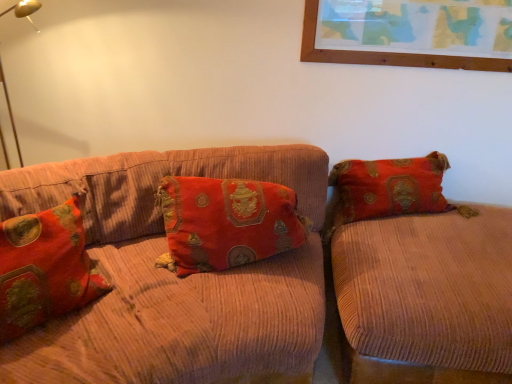
Locate an element on the screen. The image size is (512, 384). velvet-like red pillow at left, the 2th pillow viewed from the right is located at coordinates (45, 269).

Locate an element on the screen. velvet orange couch at right, the second studio couch when ordered from left to right is located at coordinates (420, 276).

The image size is (512, 384). What do you see at coordinates (175, 278) in the screenshot?
I see `corduroy couch at center, the 2th studio couch positioned from the right` at bounding box center [175, 278].

What are the coordinates of `velvet-like red pillow at left, the 2th pillow viewed from the right` in the screenshot? It's located at (45, 269).

Which is more to the right, velvet-like red pillow at left, the 2th pillow viewed from the right, or velvet-like red pillow at center, which appears as the 1th pillow when viewed from the right?

velvet-like red pillow at center, which appears as the 1th pillow when viewed from the right, is more to the right.

Which point is more forward, [53,271] or [238,244]?

The point [53,271] is in front.

Is velvet-like red pillow at left, the 2th pillow viewed from the right, closer to camera compared to velvet-like red pillow at center, which appears as the 1th pillow when viewed from the right?

Yes, it is in front of velvet-like red pillow at center, which appears as the 1th pillow when viewed from the right.

Does velvet-like red pillow at left, which is the 1th pillow in left-to-right order, have a larger size compared to velvet-like red pillow at center, which appears as the 1th pillow when viewed from the right?

Indeed, velvet-like red pillow at left, which is the 1th pillow in left-to-right order, has a larger size compared to velvet-like red pillow at center, which appears as the 1th pillow when viewed from the right.

Considering the positions of objects velvet-like red pillow at left, the 2th pillow viewed from the right, and corduroy couch at center, which is counted as the first studio couch, starting from the left, in the image provided, who is behind, velvet-like red pillow at left, the 2th pillow viewed from the right, or corduroy couch at center, which is counted as the first studio couch, starting from the left,?

corduroy couch at center, which is counted as the first studio couch, starting from the left, is further away from the camera.

In the scene shown: Does velvet-like red pillow at left, the 2th pillow viewed from the right, have a larger size compared to corduroy couch at center, which is counted as the first studio couch, starting from the left?

No.

Is velvet-like red pillow at left, which is the 1th pillow in left-to-right order, not within corduroy couch at center, which is counted as the first studio couch, starting from the left?

No, velvet-like red pillow at left, which is the 1th pillow in left-to-right order, is inside or overlapping with corduroy couch at center, which is counted as the first studio couch, starting from the left.

Is velvet-like red pillow at center, the second pillow positioned from the left, further to the viewer compared to corduroy couch at center, which is counted as the first studio couch, starting from the left?

Yes.

Does velvet-like red pillow at center, which appears as the 1th pillow when viewed from the right, have a greater height compared to corduroy couch at center, which is counted as the first studio couch, starting from the left?

No, velvet-like red pillow at center, which appears as the 1th pillow when viewed from the right, is not taller than corduroy couch at center, which is counted as the first studio couch, starting from the left.

Does velvet-like red pillow at center, the second pillow positioned from the left, have a lesser width compared to corduroy couch at center, which is counted as the first studio couch, starting from the left?

Correct, the width of velvet-like red pillow at center, the second pillow positioned from the left, is less than that of corduroy couch at center, which is counted as the first studio couch, starting from the left.

Consider the image. From a real-world perspective, which object stands above the other?

corduroy couch at center, which is counted as the first studio couch, starting from the left, from a real-world perspective.

Can you tell me how much corduroy couch at center, the 2th studio couch positioned from the right, and velvet orange couch at right, the second studio couch when ordered from left to right, differ in facing direction?

93.6 degrees separate the facing orientations of corduroy couch at center, the 2th studio couch positioned from the right, and velvet orange couch at right, the second studio couch when ordered from left to right.

Considering the sizes of objects corduroy couch at center, which is counted as the first studio couch, starting from the left, and velvet orange couch at right, which appears as the 1th studio couch when viewed from the right, in the image provided, who is shorter, corduroy couch at center, which is counted as the first studio couch, starting from the left, or velvet orange couch at right, which appears as the 1th studio couch when viewed from the right,?

velvet orange couch at right, which appears as the 1th studio couch when viewed from the right.

Can you confirm if corduroy couch at center, which is counted as the first studio couch, starting from the left, is smaller than velvet orange couch at right, the second studio couch when ordered from left to right?

Incorrect, corduroy couch at center, which is counted as the first studio couch, starting from the left, is not smaller in size than velvet orange couch at right, the second studio couch when ordered from left to right.

Is corduroy couch at center, the 2th studio couch positioned from the right, beside velvet-like red pillow at left, which is the 1th pillow in left-to-right order?

There is a gap between corduroy couch at center, the 2th studio couch positioned from the right, and velvet-like red pillow at left, which is the 1th pillow in left-to-right order.

From a real-world perspective, who is located lower, corduroy couch at center, the 2th studio couch positioned from the right, or velvet-like red pillow at left, which is the 1th pillow in left-to-right order?

From a 3D spatial view, corduroy couch at center, the 2th studio couch positioned from the right, is below.

Considering their positions, is corduroy couch at center, which is counted as the first studio couch, starting from the left, located in front of or behind velvet-like red pillow at left, which is the 1th pillow in left-to-right order?

Clearly, corduroy couch at center, which is counted as the first studio couch, starting from the left, is behind velvet-like red pillow at left, which is the 1th pillow in left-to-right order.

Looking at the image, does corduroy couch at center, which is counted as the first studio couch, starting from the left, seem bigger or smaller compared to velvet-like red pillow at center, which appears as the 1th pillow when viewed from the right?

Clearly, corduroy couch at center, which is counted as the first studio couch, starting from the left, is larger in size than velvet-like red pillow at center, which appears as the 1th pillow when viewed from the right.

Is corduroy couch at center, which is counted as the first studio couch, starting from the left, placed right next to velvet-like red pillow at center, the second pillow positioned from the left?

No, corduroy couch at center, which is counted as the first studio couch, starting from the left, is not making contact with velvet-like red pillow at center, the second pillow positioned from the left.

From their relative heights in the image, would you say corduroy couch at center, which is counted as the first studio couch, starting from the left, is taller or shorter than velvet-like red pillow at center, the second pillow positioned from the left?

Clearly, corduroy couch at center, which is counted as the first studio couch, starting from the left, is taller compared to velvet-like red pillow at center, the second pillow positioned from the left.

Based on the photo, how different are the orientations of corduroy couch at center, which is counted as the first studio couch, starting from the left, and velvet-like red pillow at center, the second pillow positioned from the left, in degrees?

The angle between the facing direction of corduroy couch at center, which is counted as the first studio couch, starting from the left, and the facing direction of velvet-like red pillow at center, the second pillow positioned from the left, is 73.3 degrees.

Is velvet orange couch at right, which appears as the 1th studio couch when viewed from the right, positioned with its back to corduroy couch at center, which is counted as the first studio couch, starting from the left?

velvet orange couch at right, which appears as the 1th studio couch when viewed from the right, is not turned away from corduroy couch at center, which is counted as the first studio couch, starting from the left.

The width and height of the screenshot is (512, 384). Find the location of `studio couch that is above the velvet orange couch at right, which appears as the 1th studio couch when viewed from the right (from the image's perspective)`. studio couch that is above the velvet orange couch at right, which appears as the 1th studio couch when viewed from the right (from the image's perspective) is located at coordinates (175, 278).

How many degrees apart are the facing directions of velvet orange couch at right, the second studio couch when ordered from left to right, and corduroy couch at center, the 2th studio couch positioned from the right?

93.6 degrees.

From a real-world perspective, is velvet orange couch at right, which appears as the 1th studio couch when viewed from the right, positioned above or below corduroy couch at center, which is counted as the first studio couch, starting from the left?

Clearly, from a real-world perspective, velvet orange couch at right, which appears as the 1th studio couch when viewed from the right, is below corduroy couch at center, which is counted as the first studio couch, starting from the left.

This screenshot has width=512, height=384. There is a velvet-like red pillow at center, the second pillow positioned from the left. Identify the location of pillow above it (from a real-world perspective). 45,269.

I want to click on studio couch that is the 1st object directly below the velvet-like red pillow at left, the 2th pillow viewed from the right (from a real-world perspective), so tap(175, 278).

Looking at the image, which one is located further to velvet orange couch at right, the second studio couch when ordered from left to right, corduroy couch at center, which is counted as the first studio couch, starting from the left, or velvet-like red pillow at center, the second pillow positioned from the left?

velvet-like red pillow at center, the second pillow positioned from the left.

Looking at this image, considering their positions, is corduroy couch at center, the 2th studio couch positioned from the right, positioned further to velvet-like red pillow at center, the second pillow positioned from the left, than velvet orange couch at right, the second studio couch when ordered from left to right?

Among the two, velvet orange couch at right, the second studio couch when ordered from left to right, is located further to velvet-like red pillow at center, the second pillow positioned from the left.

Based on their spatial positions, is velvet orange couch at right, which appears as the 1th studio couch when viewed from the right, or corduroy couch at center, the 2th studio couch positioned from the right, closer to velvet-like red pillow at left, which is the 1th pillow in left-to-right order?

corduroy couch at center, the 2th studio couch positioned from the right, lies closer to velvet-like red pillow at left, which is the 1th pillow in left-to-right order, than the other object.

Looking at the image, which one is located closer to velvet orange couch at right, the second studio couch when ordered from left to right, velvet-like red pillow at center, which appears as the 1th pillow when viewed from the right, or velvet-like red pillow at left, the 2th pillow viewed from the right?

velvet-like red pillow at center, which appears as the 1th pillow when viewed from the right, is closer to velvet orange couch at right, the second studio couch when ordered from left to right.

Which object lies nearer to the anchor point corduroy couch at center, the 2th studio couch positioned from the right, velvet-like red pillow at center, the second pillow positioned from the left, or velvet orange couch at right, the second studio couch when ordered from left to right?

Among the two, velvet-like red pillow at center, the second pillow positioned from the left, is located nearer to corduroy couch at center, the 2th studio couch positioned from the right.

Looking at the image, which one is located further to velvet orange couch at right, which appears as the 1th studio couch when viewed from the right, velvet-like red pillow at left, the 2th pillow viewed from the right, or corduroy couch at center, which is counted as the first studio couch, starting from the left?

velvet-like red pillow at left, the 2th pillow viewed from the right, is further to velvet orange couch at right, which appears as the 1th studio couch when viewed from the right.

Based on their spatial positions, is velvet orange couch at right, which appears as the 1th studio couch when viewed from the right, or velvet-like red pillow at left, which is the 1th pillow in left-to-right order, closer to corduroy couch at center, which is counted as the first studio couch, starting from the left?

velvet-like red pillow at left, which is the 1th pillow in left-to-right order, is closer to corduroy couch at center, which is counted as the first studio couch, starting from the left.

Which object lies further to the anchor point velvet-like red pillow at center, which appears as the 1th pillow when viewed from the right, velvet orange couch at right, the second studio couch when ordered from left to right, or velvet-like red pillow at left, which is the 1th pillow in left-to-right order?

Based on the image, velvet orange couch at right, the second studio couch when ordered from left to right, appears to be further to velvet-like red pillow at center, which appears as the 1th pillow when viewed from the right.

The height and width of the screenshot is (384, 512). Find the location of `studio couch between velvet-like red pillow at left, the 2th pillow viewed from the right, and velvet-like red pillow at center, the second pillow positioned from the left, from left to right`. studio couch between velvet-like red pillow at left, the 2th pillow viewed from the right, and velvet-like red pillow at center, the second pillow positioned from the left, from left to right is located at coordinates (175, 278).

This screenshot has height=384, width=512. Find the location of `pillow between corduroy couch at center, the 2th studio couch positioned from the right, and velvet orange couch at right, which appears as the 1th studio couch when viewed from the right, from left to right`. pillow between corduroy couch at center, the 2th studio couch positioned from the right, and velvet orange couch at right, which appears as the 1th studio couch when viewed from the right, from left to right is located at coordinates (226, 223).

Image resolution: width=512 pixels, height=384 pixels. What are the coordinates of `studio couch between velvet-like red pillow at left, which is the 1th pillow in left-to-right order, and velvet orange couch at right, the second studio couch when ordered from left to right, from left to right` in the screenshot? It's located at tap(175, 278).

Image resolution: width=512 pixels, height=384 pixels. I want to click on pillow located between velvet-like red pillow at left, the 2th pillow viewed from the right, and velvet orange couch at right, the second studio couch when ordered from left to right, in the left-right direction, so [226, 223].